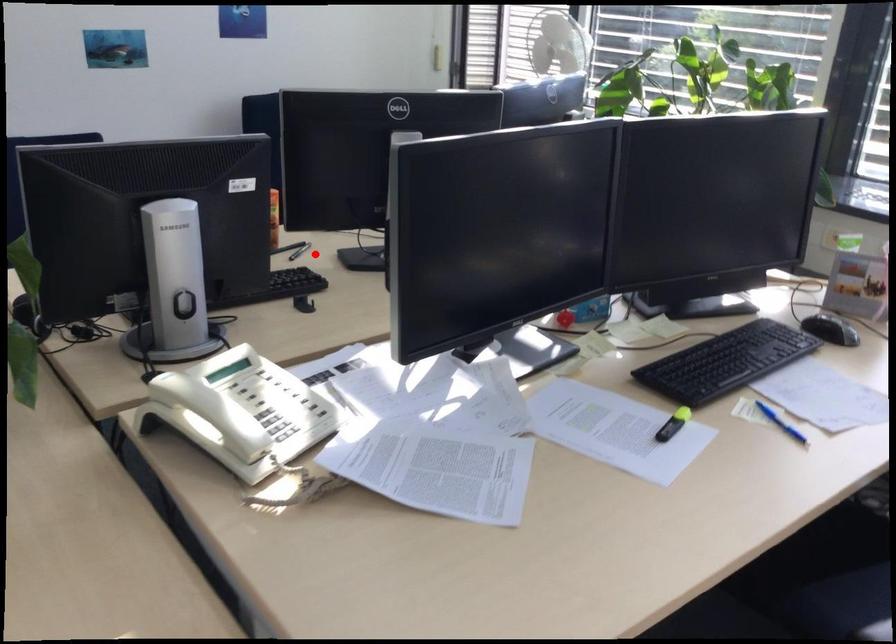
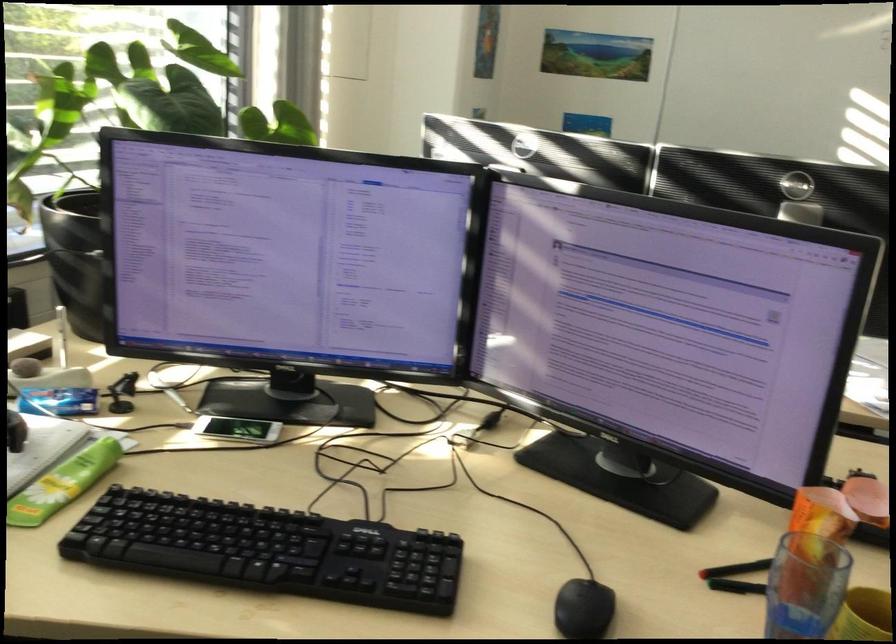
Question: I am providing you with two images of the same scene from different viewpoints. Image1 has a red point marked. In image2, the corresponding 3D location appears at what relative position? Reply with the corresponding letter.

Choices:
 (A) Closer
 (B) Farther

Answer: (A)